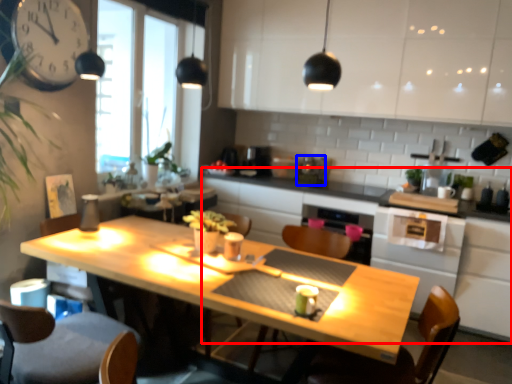
Question: Which object appears closest to the camera in this image, counter (highlighted by a red box) or appliance (highlighted by a blue box)?

Choices:
 (A) counter
 (B) appliance

Answer: (A)